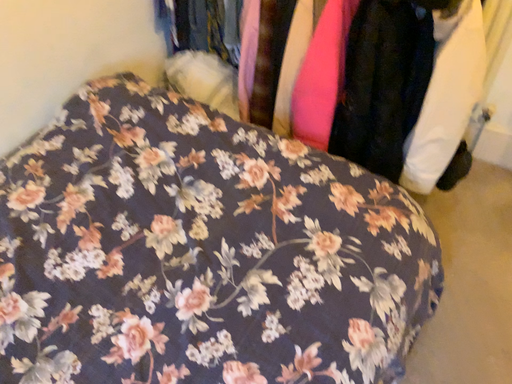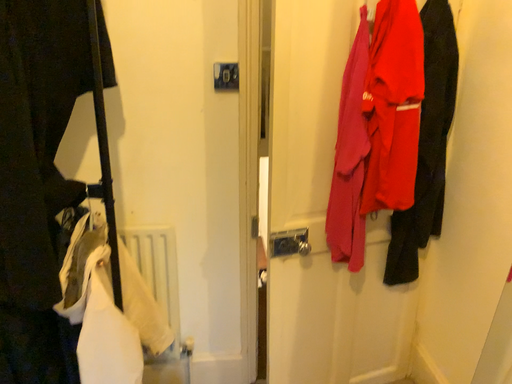
Question: How did the camera likely rotate when shooting the video?

Choices:
 (A) rotated left
 (B) rotated right

Answer: (B)